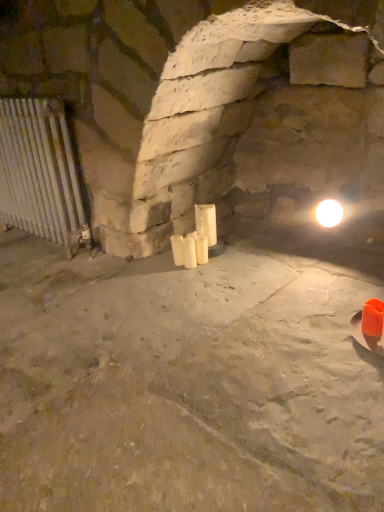
Describe the element at coordinates (178, 249) in the screenshot. Image resolution: width=384 pixels, height=512 pixels. I see `white matte candle at center, the first candle positioned from the left` at that location.

Describe the element at coordinates (40, 173) in the screenshot. Image resolution: width=384 pixels, height=512 pixels. I see `silver metallic radiator at left` at that location.

Describe the element at coordinates (189, 252) in the screenshot. This screenshot has width=384, height=512. I see `white matte candle at center, the second candle positioned from the left` at that location.

At what (x,y) coordinates should I click in order to perform the action: click on white matte candle at center, which ranks as the 3th candle in right-to-left order. Please return your answer as a coordinate pair (x, y). Image resolution: width=384 pixels, height=512 pixels. Looking at the image, I should click on (178, 249).

Locate an element on the screen. This screenshot has width=384, height=512. candle that is the 3rd object located below the silver metallic radiator at left (from the image's perspective) is located at coordinates (189, 252).

Is white matte candle at center, which is the second candle from right to left, bigger than silver metallic radiator at left?

Actually, white matte candle at center, which is the second candle from right to left, might be smaller than silver metallic radiator at left.

Does point (196, 258) appear closer or farther from the camera than point (51, 184)?

Point (196, 258) appears to be closer to the viewer than point (51, 184).

From a real-world perspective, is silver metallic radiator at left below white matte candle at center, which is the second candle from right to left?

No.

Can you confirm if silver metallic radiator at left is taller than white matte candle at center, the second candle positioned from the left?

Yes.

Is silver metallic radiator at left not near white matte candle at center, the second candle positioned from the left?

No, silver metallic radiator at left is in close proximity to white matte candle at center, the second candle positioned from the left.

Which object is positioned more to the left, silver metallic radiator at left or white matte candle at center, which is the second candle from right to left?

From the viewer's perspective, silver metallic radiator at left appears more on the left side.

Does point (4, 165) lie behind point (181, 250)?

Yes, point (4, 165) is farther from viewer.

Can you tell me how much silver metallic radiator at left and white matte candle at center, which ranks as the 3th candle in right-to-left order, differ in facing direction?

The angle between the facing direction of silver metallic radiator at left and the facing direction of white matte candle at center, which ranks as the 3th candle in right-to-left order, is 4.82 degrees.

You are a GUI agent. You are given a task and a screenshot of the screen. Output one action in this format:
    pyautogui.click(x=<x>, y=<y>)
    Task: Click on the cage lying in front of the white matte candle at center, the first candle positioned from the left
    Image resolution: width=384 pixels, height=512 pixels.
    Given the screenshot: What is the action you would take?
    pyautogui.click(x=40, y=173)

Looking at this image, based on their positions, is silver metallic radiator at left located to the left or right of white matte candle at center, which ranks as the 3th candle in right-to-left order?

silver metallic radiator at left is positioned on white matte candle at center, which ranks as the 3th candle in right-to-left order,'s left side.

From a real-world perspective, which is physically below, white matte candle at center, which ranks as the 3th candle in right-to-left order, or white matte candle at center, which is the second candle from right to left?

In real-world perspective, white matte candle at center, which ranks as the 3th candle in right-to-left order, is lower.

From the image's perspective, is white matte candle at center, which ranks as the 3th candle in right-to-left order, below white matte candle at center, which is the second candle from right to left?

No, from the image's perspective, white matte candle at center, which ranks as the 3th candle in right-to-left order, is not beneath white matte candle at center, which is the second candle from right to left.

Is white matte candle at center, the first candle positioned from the left, oriented towards white matte candle at center, the second candle positioned from the left?

No, white matte candle at center, the first candle positioned from the left, is not turned towards white matte candle at center, the second candle positioned from the left.

From the picture: Does white matte candle at center, which ranks as the 3th candle in right-to-left order, come in front of white matte candle at center, the second candle positioned from the left?

No, white matte candle at center, which ranks as the 3th candle in right-to-left order, is behind white matte candle at center, the second candle positioned from the left.

Considering the sizes of objects white matte candle at center, which ranks as the 3th candle in right-to-left order, and white matte candle at center, which is counted as the 3th candle, starting from the left, in the image provided, who is wider, white matte candle at center, which ranks as the 3th candle in right-to-left order, or white matte candle at center, which is counted as the 3th candle, starting from the left,?

Wider between the two is white matte candle at center, which is counted as the 3th candle, starting from the left.

Between white matte candle at center, the first candle positioned from the left, and white matte candle at center, which is counted as the 3th candle, starting from the left, which one has larger size?

Bigger between the two is white matte candle at center, which is counted as the 3th candle, starting from the left.

Is white matte candle at center, which ranks as the 3th candle in right-to-left order, shorter than white matte candle at center, which ranks as the first candle in right-to-left order?

Indeed, white matte candle at center, which ranks as the 3th candle in right-to-left order, has a lesser height compared to white matte candle at center, which ranks as the first candle in right-to-left order.

Is there a large distance between white matte candle at center, which ranks as the 3th candle in right-to-left order, and white matte candle at center, which ranks as the first candle in right-to-left order?

They are positioned close to each other.

How far apart are silver metallic radiator at left and white matte candle at center, which is counted as the 3th candle, starting from the left?

The distance of silver metallic radiator at left from white matte candle at center, which is counted as the 3th candle, starting from the left, is 32.58 inches.

Is point (28, 207) farther from viewer compared to point (195, 244)?

That is True.

Is silver metallic radiator at left aimed at white matte candle at center, which ranks as the first candle in right-to-left order?

No, silver metallic radiator at left does not turn towards white matte candle at center, which ranks as the first candle in right-to-left order.

Between silver metallic radiator at left and white matte candle at center, which ranks as the first candle in right-to-left order, which one appears on the left side from the viewer's perspective?

silver metallic radiator at left is more to the left.

Is white matte candle at center, which ranks as the 3th candle in right-to-left order, completely or partially outside of silver metallic radiator at left?

white matte candle at center, which ranks as the 3th candle in right-to-left order, lies outside silver metallic radiator at left's area.

Is white matte candle at center, which ranks as the 3th candle in right-to-left order, taller or shorter than silver metallic radiator at left?

Clearly, white matte candle at center, which ranks as the 3th candle in right-to-left order, is shorter compared to silver metallic radiator at left.

From the image's perspective, is white matte candle at center, which ranks as the 3th candle in right-to-left order, located beneath silver metallic radiator at left?

Yes, from the image's perspective, white matte candle at center, which ranks as the 3th candle in right-to-left order, is beneath silver metallic radiator at left.

The height and width of the screenshot is (512, 384). I want to click on the 2nd candle below the silver metallic radiator at left (from the image's perspective), so point(178,249).

Identify the location of candle that is the 2nd object to the right of the silver metallic radiator at left, starting at the anchor. This screenshot has width=384, height=512. coord(189,252).

Where is `cage above the white matte candle at center, which is the second candle from right to left (from the image's perspective)`? cage above the white matte candle at center, which is the second candle from right to left (from the image's perspective) is located at coordinates (40, 173).

Considering their positions, is white matte candle at center, which is counted as the 3th candle, starting from the left, positioned closer to white matte candle at center, which ranks as the 3th candle in right-to-left order, than white matte candle at center, which is the second candle from right to left?

white matte candle at center, which is the second candle from right to left.

When comparing their distances from white matte candle at center, which ranks as the first candle in right-to-left order, does white matte candle at center, which is the second candle from right to left, or white matte candle at center, the first candle positioned from the left, seem closer?

white matte candle at center, which is the second candle from right to left, is closer to white matte candle at center, which ranks as the first candle in right-to-left order.

When comparing their distances from white matte candle at center, which is the second candle from right to left, does white matte candle at center, which is counted as the 3th candle, starting from the left, or white matte candle at center, which ranks as the 3th candle in right-to-left order, seem closer?

The object closer to white matte candle at center, which is the second candle from right to left, is white matte candle at center, which ranks as the 3th candle in right-to-left order.

Estimate the real-world distances between objects in this image. Which object is further from white matte candle at center, which is counted as the 3th candle, starting from the left, silver metallic radiator at left or white matte candle at center, which ranks as the 3th candle in right-to-left order?

The object further to white matte candle at center, which is counted as the 3th candle, starting from the left, is silver metallic radiator at left.

When comparing their distances from silver metallic radiator at left, does white matte candle at center, the second candle positioned from the left, or white matte candle at center, the first candle positioned from the left, seem closer?

The object closer to silver metallic radiator at left is white matte candle at center, the first candle positioned from the left.

Based on their spatial positions, is white matte candle at center, which is the second candle from right to left, or white matte candle at center, which is counted as the 3th candle, starting from the left, closer to white matte candle at center, which ranks as the 3th candle in right-to-left order?

white matte candle at center, which is the second candle from right to left, is positioned closer to the anchor white matte candle at center, which ranks as the 3th candle in right-to-left order.

Based on their spatial positions, is white matte candle at center, the first candle positioned from the left, or white matte candle at center, which is counted as the 3th candle, starting from the left, further from silver metallic radiator at left?

white matte candle at center, which is counted as the 3th candle, starting from the left.

Looking at the image, which one is located closer to white matte candle at center, which is counted as the 3th candle, starting from the left, white matte candle at center, which ranks as the 3th candle in right-to-left order, or silver metallic radiator at left?

white matte candle at center, which ranks as the 3th candle in right-to-left order, is positioned closer to the anchor white matte candle at center, which is counted as the 3th candle, starting from the left.

Where is `candle between silver metallic radiator at left and white matte candle at center, which is the second candle from right to left`? candle between silver metallic radiator at left and white matte candle at center, which is the second candle from right to left is located at coordinates (178, 249).

Locate an element on the screen. The image size is (384, 512). candle between white matte candle at center, which ranks as the 3th candle in right-to-left order, and white matte candle at center, which ranks as the first candle in right-to-left order is located at coordinates (189, 252).